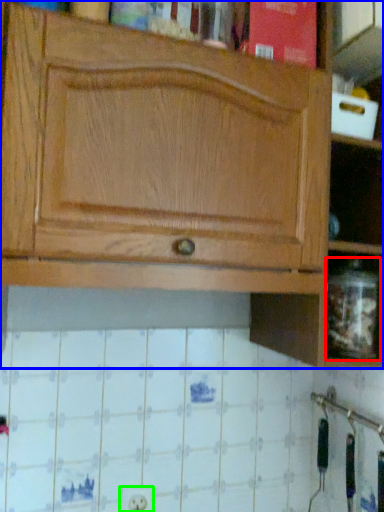
Question: Which is farther away from glass jar (highlighted by a red box)? cabinetry (highlighted by a blue box) or electric outlet (highlighted by a green box)?

Choices:
 (A) cabinetry
 (B) electric outlet

Answer: (B)